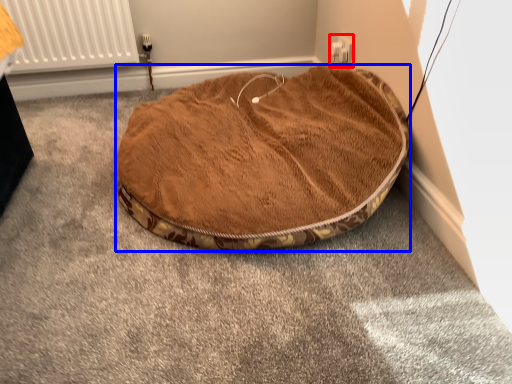
Question: Which point is closer to the camera, electric outlet (highlighted by a red box) or dog bed (highlighted by a blue box)?

Choices:
 (A) electric outlet
 (B) dog bed

Answer: (B)